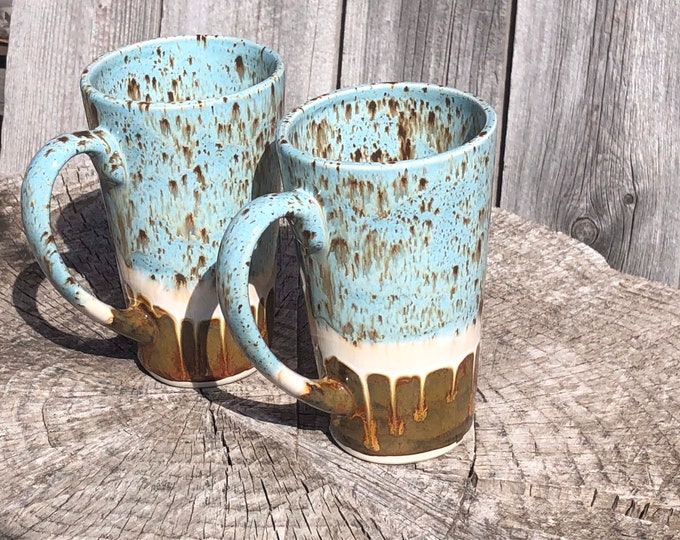
In order to click on mug in this screenshot , I will do `click(408, 238)`.